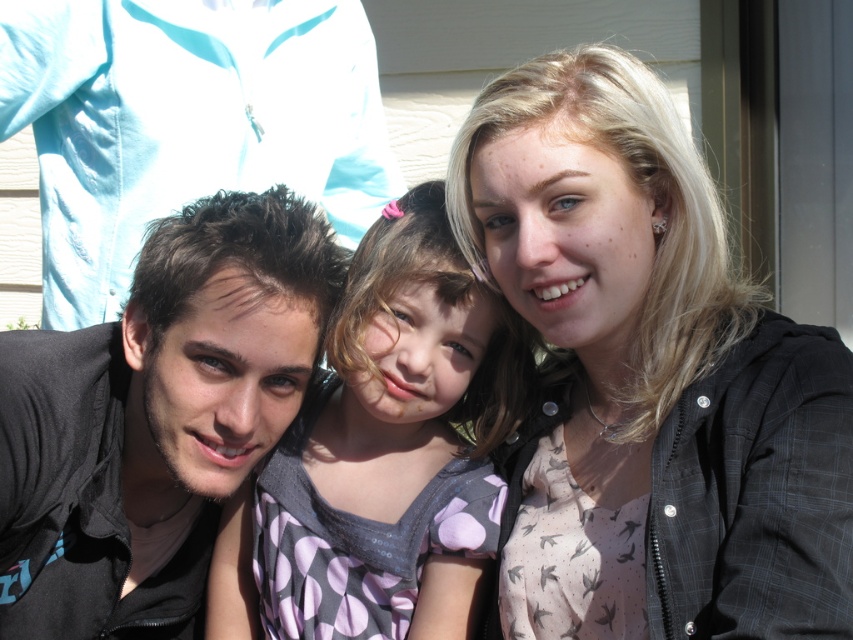
You are a photographer trying to adjust the lighting for a group photo. The scene has two people with distinct hair colors and positions. The blonde hair at upper right and dark brown hair at left are in your frame. Based on their sizes in the photo, which person should you focus the light on to ensure both are well lit?

The blonde hair at upper right is bigger than the dark brown hair at left, so you should focus the light on the blonde hair at upper right to ensure both are well lit.